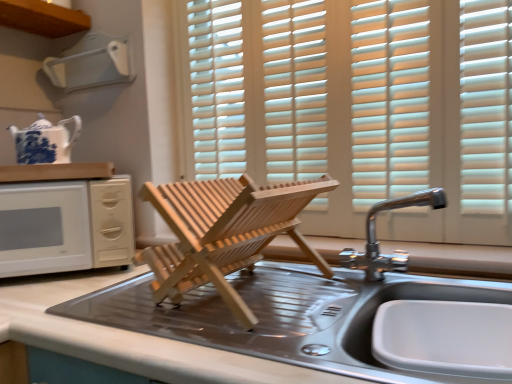
In order to face blue and white porcelain teapot at upper left, should I rotate leftwards or rightwards?

Rotate left and turn 26.383 degrees.

Measure the distance between point (214, 273) and camera.

Point (214, 273) and camera are 30.08 inches apart.

You are a GUI agent. You are given a task and a screenshot of the screen. Output one action in this format:
    pyautogui.click(x=<x>, y=<y>)
    Task: Click on the metallic stainless steel sink at center, the 2th countertop from the left
    
    Given the screenshot: What is the action you would take?
    pyautogui.click(x=129, y=338)

Identify the location of white wood blinds at center. The width and height of the screenshot is (512, 384). (356, 107).

Could you tell me if metallic stainless steel sink at center, which is the first countertop in right-to-left order, is turned towards white matte microwave at left?

No, metallic stainless steel sink at center, which is the first countertop in right-to-left order, is not turned towards white matte microwave at left.

Find the location of a particular element. microwave lying above the metallic stainless steel sink at center, placed as the 2th countertop when sorted from top to bottom (from the image's perspective) is located at coordinates (65, 226).

From a real-world perspective, which is physically above, metallic stainless steel sink at center, which is the first countertop in bottom-to-top order, or white matte microwave at left?

white matte microwave at left is physically above.

The height and width of the screenshot is (384, 512). What are the coordinates of `tap located behind the metallic stainless steel sink at center` in the screenshot? It's located at (378, 242).

Between metallic stainless steel sink at center and chrome metallic faucet at upper right, which one has larger width?

metallic stainless steel sink at center is wider.

From the picture: Considering the sizes of objects metallic stainless steel sink at center and chrome metallic faucet at upper right in the image provided, who is bigger, metallic stainless steel sink at center or chrome metallic faucet at upper right?

metallic stainless steel sink at center.

Considering the relative positions of metallic stainless steel sink at center and chrome metallic faucet at upper right in the image provided, is metallic stainless steel sink at center to the right of chrome metallic faucet at upper right from the viewer's perspective?

No, metallic stainless steel sink at center is not to the right of chrome metallic faucet at upper right.

Between point (86, 50) and point (74, 173), which one is positioned in front?

Positioned in front is point (74, 173).

From the picture: Which object is positioned more to the right, white plastic vent at upper left or white wood countertop at upper left, which is counted as the 2th countertop, starting from the bottom?

white plastic vent at upper left is more to the right.

Is white plastic vent at upper left positioned with its back to white wood countertop at upper left, which is counted as the 2th countertop, starting from the bottom?

No.

How many degrees apart are the facing directions of blue and white porcelain teapot at upper left and metallic stainless steel sink at center, which is the first countertop in bottom-to-top order?

46.4 degrees.

Which of these two, blue and white porcelain teapot at upper left or metallic stainless steel sink at center, the 2th countertop from the left, stands shorter?

Standing shorter between the two is blue and white porcelain teapot at upper left.

Is blue and white porcelain teapot at upper left next to metallic stainless steel sink at center, the 2th countertop from the left, and touching it?

No, blue and white porcelain teapot at upper left is not in contact with metallic stainless steel sink at center, the 2th countertop from the left.

Could you tell me if blue and white porcelain teapot at upper left is turned towards metallic stainless steel sink at center, which is the first countertop in bottom-to-top order?

No, blue and white porcelain teapot at upper left does not turn towards metallic stainless steel sink at center, which is the first countertop in bottom-to-top order.

Does white wood blinds at center touch metallic stainless steel sink at center?

No, white wood blinds at center is not making contact with metallic stainless steel sink at center.

Considering the sizes of objects white wood blinds at center and metallic stainless steel sink at center in the image provided, who is thinner, white wood blinds at center or metallic stainless steel sink at center?

Thinner between the two is white wood blinds at center.

Based on the photo, from a real-world perspective, which is physically below, white wood blinds at center or metallic stainless steel sink at center?

From a 3D spatial view, metallic stainless steel sink at center is below.

From the image's perspective, would you say white wood blinds at center is positioned over metallic stainless steel sink at center?

Correct, white wood blinds at center appears higher than metallic stainless steel sink at center in the image.

Considering the sizes of objects white wood blinds at center and blue and white porcelain teapot at upper left in the image provided, who is taller, white wood blinds at center or blue and white porcelain teapot at upper left?

Standing taller between the two is white wood blinds at center.

Which is nearer, (221, 104) or (29, 137)?

Point (221, 104).

Is blue and white porcelain teapot at upper left located within white wood blinds at center?

No, blue and white porcelain teapot at upper left is not surrounded by white wood blinds at center.

Between white wood blinds at center and blue and white porcelain teapot at upper left, which one has smaller size?

blue and white porcelain teapot at upper left.

Based on their sizes in the image, would you say blue and white porcelain teapot at upper left is bigger or smaller than metallic stainless steel sink at center?

Clearly, blue and white porcelain teapot at upper left is smaller in size than metallic stainless steel sink at center.

Looking at this image, is blue and white porcelain teapot at upper left looking in the opposite direction of metallic stainless steel sink at center?

No, blue and white porcelain teapot at upper left's orientation is not away from metallic stainless steel sink at center.

Is blue and white porcelain teapot at upper left touching metallic stainless steel sink at center?

No, blue and white porcelain teapot at upper left is not beside metallic stainless steel sink at center.

In the image, there is a metallic stainless steel sink at center, the 2th countertop from the left. Where is `microwave above it (from the image's perspective)`? Image resolution: width=512 pixels, height=384 pixels. microwave above it (from the image's perspective) is located at coordinates (65, 226).

Identify the location of sink to the left of chrome metallic faucet at upper right. The height and width of the screenshot is (384, 512). (224, 234).

Considering their positions, is white wood countertop at upper left, the second countertop viewed from the right, positioned further to white plastic vent at upper left than blue and white porcelain teapot at upper left?

Among the two, white wood countertop at upper left, the second countertop viewed from the right, is located further to white plastic vent at upper left.

Considering their positions, is white wood countertop at upper left, marked as the 1th countertop in a left-to-right arrangement, positioned closer to white matte microwave at left than metallic stainless steel sink at center?

white wood countertop at upper left, marked as the 1th countertop in a left-to-right arrangement, is closer to white matte microwave at left.

Estimate the real-world distances between objects in this image. Which object is further from white wood countertop at upper left, marked as the 1th countertop in a left-to-right arrangement, metallic stainless steel sink at center, which is the first countertop in right-to-left order, or chrome metallic faucet at upper right?

Based on the image, chrome metallic faucet at upper right appears to be further to white wood countertop at upper left, marked as the 1th countertop in a left-to-right arrangement.

Looking at the image, which one is located further to metallic stainless steel sink at center, which is the first countertop in bottom-to-top order, metallic stainless steel sink at center or white wood countertop at upper left, the second countertop viewed from the right?

white wood countertop at upper left, the second countertop viewed from the right, is further to metallic stainless steel sink at center, which is the first countertop in bottom-to-top order.

Based on their spatial positions, is white wood blinds at center or white wood countertop at upper left, the second countertop viewed from the right, further from white matte microwave at left?

white wood blinds at center lies further to white matte microwave at left than the other object.

Considering their positions, is white wood countertop at upper left, the second countertop viewed from the right, positioned closer to metallic stainless steel sink at center, which is the first countertop in right-to-left order, than blue and white porcelain teapot at upper left?

Among the two, white wood countertop at upper left, the second countertop viewed from the right, is located nearer to metallic stainless steel sink at center, which is the first countertop in right-to-left order.

Considering their positions, is white plastic vent at upper left positioned closer to white wood blinds at center than white wood countertop at upper left, the first countertop viewed from the top?

The object closer to white wood blinds at center is white plastic vent at upper left.

When comparing their distances from metallic stainless steel sink at center, which is the first countertop in right-to-left order, does white wood blinds at center or white wood countertop at upper left, which is counted as the 2th countertop, starting from the bottom, seem closer?

white wood countertop at upper left, which is counted as the 2th countertop, starting from the bottom.

Where is `microwave between blue and white porcelain teapot at upper left and metallic stainless steel sink at center in the horizontal direction`? microwave between blue and white porcelain teapot at upper left and metallic stainless steel sink at center in the horizontal direction is located at coordinates (65, 226).

Find the location of `sink between metallic stainless steel sink at center, placed as the 2th countertop when sorted from top to bottom, and white plastic vent at upper left from front to back`. sink between metallic stainless steel sink at center, placed as the 2th countertop when sorted from top to bottom, and white plastic vent at upper left from front to back is located at coordinates (224, 234).

You are a GUI agent. You are given a task and a screenshot of the screen. Output one action in this format:
    pyautogui.click(x=<x>, y=<y>)
    Task: Click on the tap that lies between white wood blinds at center and metallic stainless steel sink at center, placed as the 2th countertop when sorted from top to bottom, from top to bottom
    The image size is (512, 384).
    Given the screenshot: What is the action you would take?
    pyautogui.click(x=378, y=242)

This screenshot has height=384, width=512. In order to click on tea pot located between white wood countertop at upper left, marked as the 1th countertop in a left-to-right arrangement, and metallic stainless steel sink at center in the left-right direction in this screenshot , I will do `click(45, 141)`.